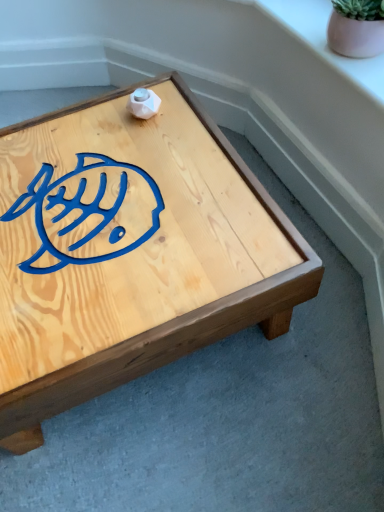
Question: Choose the correct answer: Is pink matte flowerpot at upper right inside pink ceramic pot at upper right or outside it?

Choices:
 (A) outside
 (B) inside

Answer: (A)

Question: From a real-world perspective, is pink matte flowerpot at upper right physically located above or below pink ceramic pot at upper right?

Choices:
 (A) above
 (B) below

Answer: (A)

Question: Considering the real-world distances, which object is farthest from the pink ceramic pot at upper right?

Choices:
 (A) natural wood coffee table at center
 (B) pink matte flowerpot at upper right

Answer: (A)

Question: Considering the real-world distances, which object is closest to the pink ceramic pot at upper right?

Choices:
 (A) pink matte flowerpot at upper right
 (B) natural wood coffee table at center

Answer: (A)